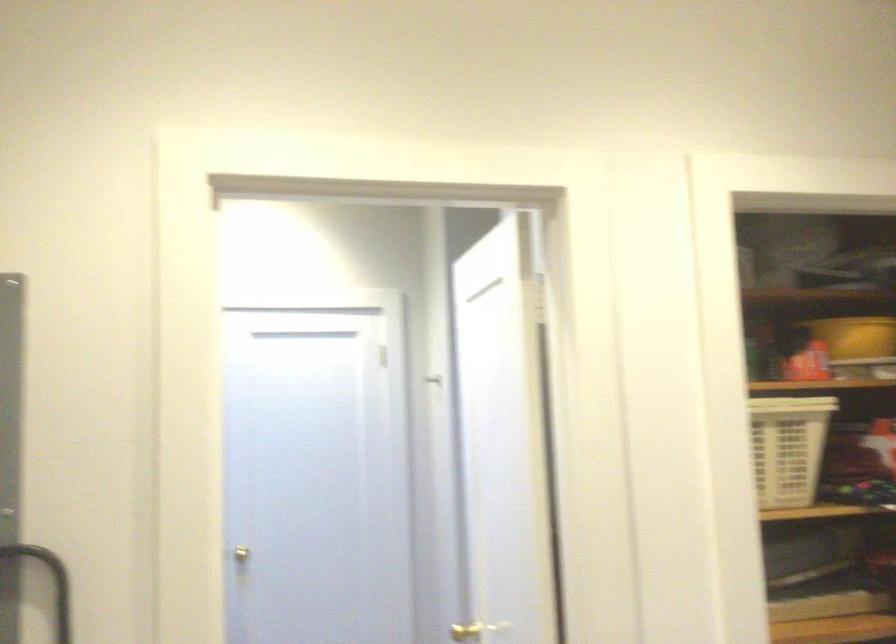
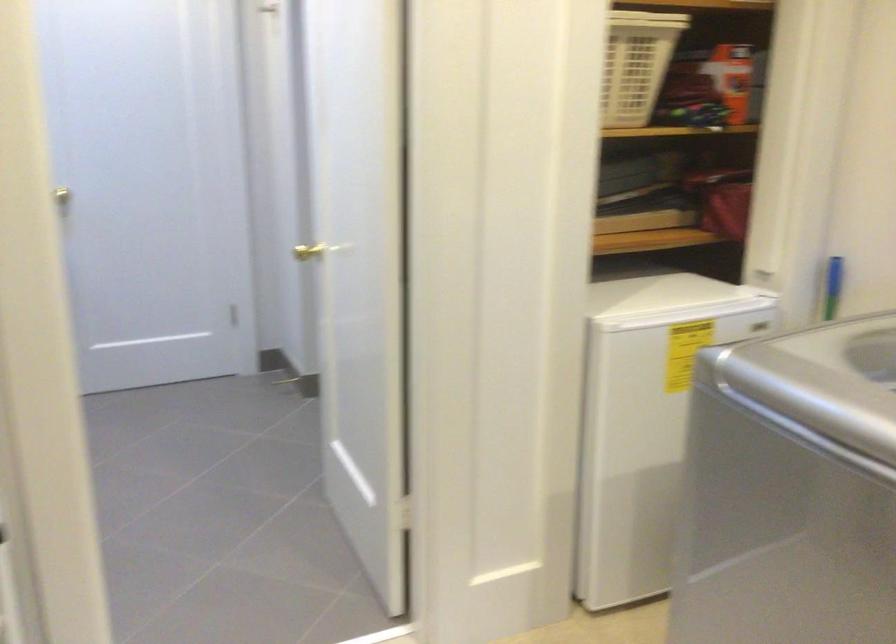
Where in the second image is the point corresponding to [787,444] from the first image?

(636, 64)